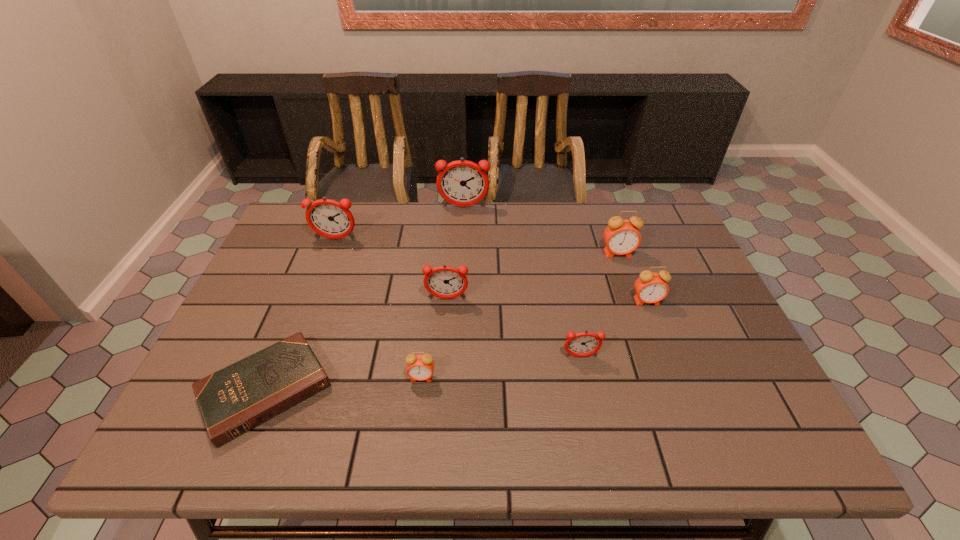
Identify the location of the leftmost pink alarm clock. The height and width of the screenshot is (540, 960). (419, 367).

I want to click on the smallest pink alarm clock, so click(x=419, y=367).

Where is `the shortest object`? the shortest object is located at coordinates (236, 399).

Locate an element on the screen. green Bible is located at coordinates (236, 399).

Where is `free space located on the front-facing side of the tallest alarm clock`? free space located on the front-facing side of the tallest alarm clock is located at coordinates (462, 242).

At what (x,y) coordinates should I click in order to perform the action: click on vacant space positioned 0.390m on the front-facing side of the seventh nearest object. Please return your answer as a coordinate pair (x, y). Looking at the image, I should click on (296, 343).

Identify the location of free space located on the face of the farthest pink alarm clock. (630, 287).

You are a GUI agent. You are given a task and a screenshot of the screen. Output one action in this format:
    pyautogui.click(x=<x>, y=<y>)
    Task: Click on the free space located on the face of the second farthest pink alarm clock
    This screenshot has width=960, height=540.
    Given the screenshot: What is the action you would take?
    pyautogui.click(x=675, y=374)

Where is `vacant area situated 0.140m on the front-facing side of the second smallest reddish-pink alarm clock`? This screenshot has width=960, height=540. vacant area situated 0.140m on the front-facing side of the second smallest reddish-pink alarm clock is located at coordinates (444, 345).

This screenshot has height=540, width=960. In order to click on free location located 0.060m on the front-facing side of the smallest reddish-pink alarm clock in this screenshot , I will do `click(586, 382)`.